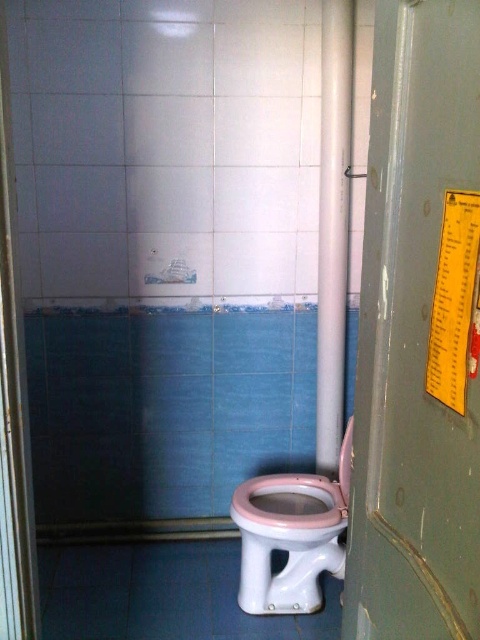
You are a plumber inspecting the bathroom and need to determine which object, the green metallic pillar at right or the white glossy pipe at center, requires more material to replace. Based on their sizes, which one would need more material?

The white glossy pipe at center requires more material to replace because it is thicker than the green metallic pillar at right.